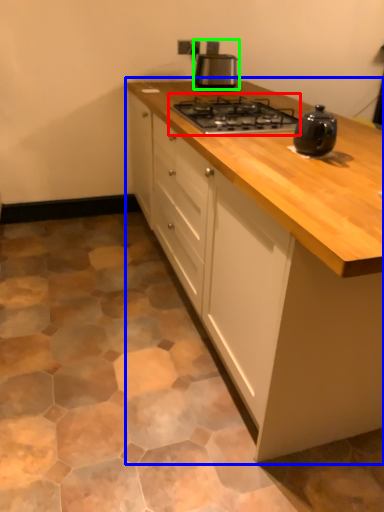
Question: Which object is positioned closest to gas stove (highlighted by a red box)? Select from cabinetry (highlighted by a blue box) and kitchen appliance (highlighted by a green box).

Choices:
 (A) cabinetry
 (B) kitchen appliance

Answer: (A)